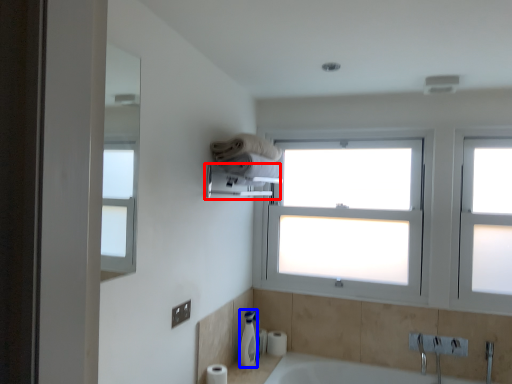
Question: Which object is further to the camera taking this photo, towel bar (highlighted by a red box) or soap dispenser (highlighted by a blue box)?

Choices:
 (A) towel bar
 (B) soap dispenser

Answer: (B)